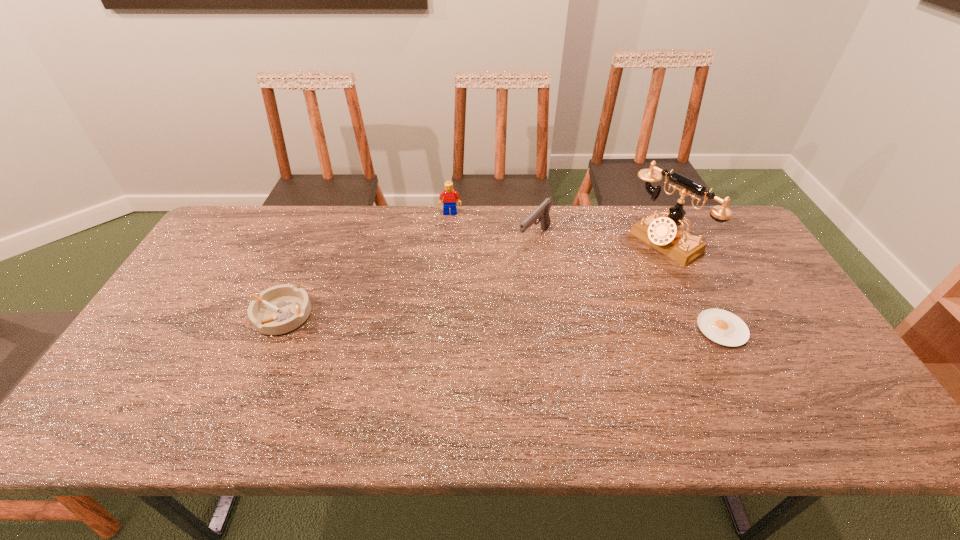
This screenshot has height=540, width=960. Identify the location of free space on the desktop that is between the fourth tallest object and the egg yolk and is positioned at the barrel of the pistol. (457, 320).

Identify the location of free space on the desktop that is between the ashtray and the egg yolk and is positioned on the front-facing side of the fourth object from right to left. Image resolution: width=960 pixels, height=540 pixels. (452, 320).

Where is `vacant space on the desktop that is between the leftmost object and the shortest object and is positioned on the dial of the telephone`? This screenshot has width=960, height=540. vacant space on the desktop that is between the leftmost object and the shortest object and is positioned on the dial of the telephone is located at coordinates (535, 322).